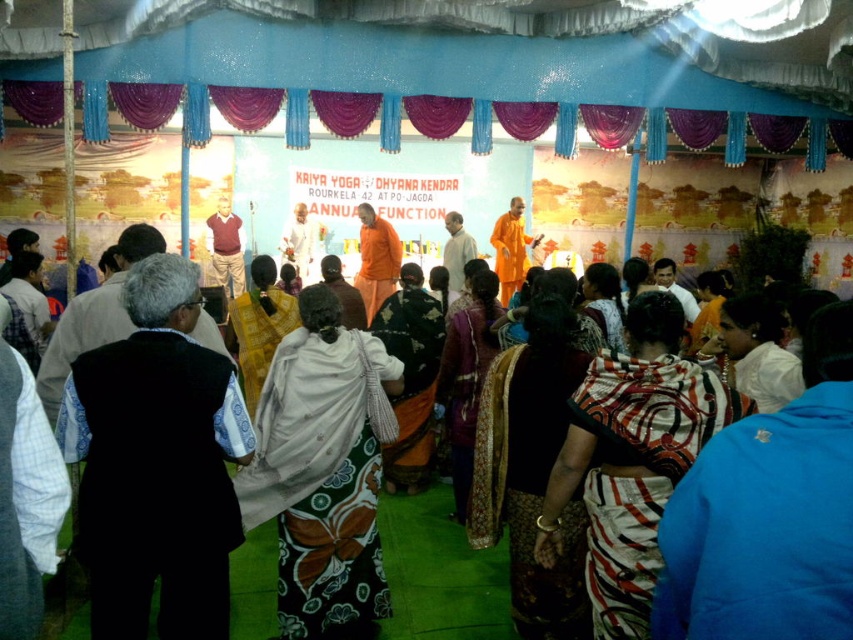
Does black fabric vest at lower left have a greater width compared to printed silk sari at center?

Correct, the width of black fabric vest at lower left exceeds that of printed silk sari at center.

Is point (207, 595) positioned after point (535, 348)?

No, it is in front of (535, 348).

You are a GUI agent. You are given a task and a screenshot of the screen. Output one action in this format:
    pyautogui.click(x=<x>, y=<y>)
    Task: Click on the black fabric vest at lower left
    
    Given the screenshot: What is the action you would take?
    pyautogui.click(x=155, y=481)

Does printed cotton saree at center have a smaller size compared to printed silk sari at center?

Yes.

The width and height of the screenshot is (853, 640). Identify the location of printed cotton saree at center. (639, 467).

Who is positioned more to the right, black fabric vest at lower left or orange cloth at center?

orange cloth at center is more to the right.

Is black fabric vest at lower left to the left of orange cloth at center from the viewer's perspective?

Indeed, black fabric vest at lower left is positioned on the left side of orange cloth at center.

Who is more forward, (210, 528) or (508, 232)?

Point (210, 528) is more forward.

This screenshot has height=640, width=853. Identify the location of black fabric vest at lower left. (155, 481).